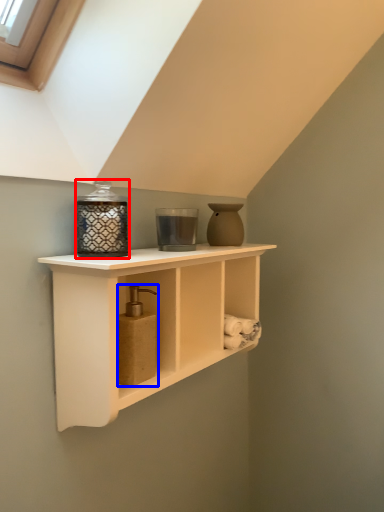
Question: Which object is further to the camera taking this photo, candle holder (highlighted by a red box) or soap dispenser (highlighted by a blue box)?

Choices:
 (A) candle holder
 (B) soap dispenser

Answer: (B)